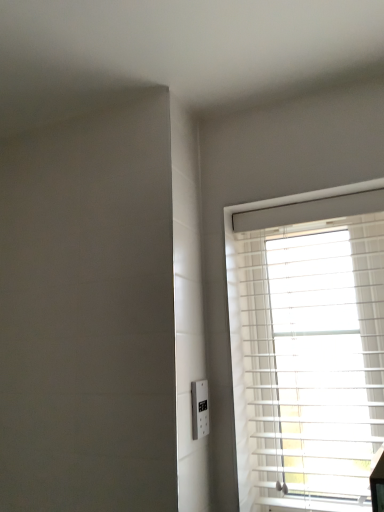
Question: From the image's perspective, is white plastic blinds at right positioned above or below white plastic electric outlet at lower right?

Choices:
 (A) above
 (B) below

Answer: (A)

Question: Is white plastic blinds at right inside the boundaries of white plastic electric outlet at lower right, or outside?

Choices:
 (A) inside
 (B) outside

Answer: (B)

Question: In the image, is white plastic blinds at right positioned in front of or behind white plastic electric outlet at lower right?

Choices:
 (A) behind
 (B) front

Answer: (B)

Question: Looking at their shapes, would you say white plastic electric outlet at lower right is wider or thinner than white plastic blinds at right?

Choices:
 (A) wide
 (B) thin

Answer: (B)

Question: Is white plastic electric outlet at lower right to the left or to the right of white plastic blinds at right in the image?

Choices:
 (A) right
 (B) left

Answer: (B)

Question: From a real-world perspective, is white plastic electric outlet at lower right physically located above or below white plastic blinds at right?

Choices:
 (A) below
 (B) above

Answer: (A)

Question: Considering the positions of point (203, 436) and point (279, 283), is point (203, 436) closer or farther from the camera than point (279, 283)?

Choices:
 (A) closer
 (B) farther

Answer: (A)